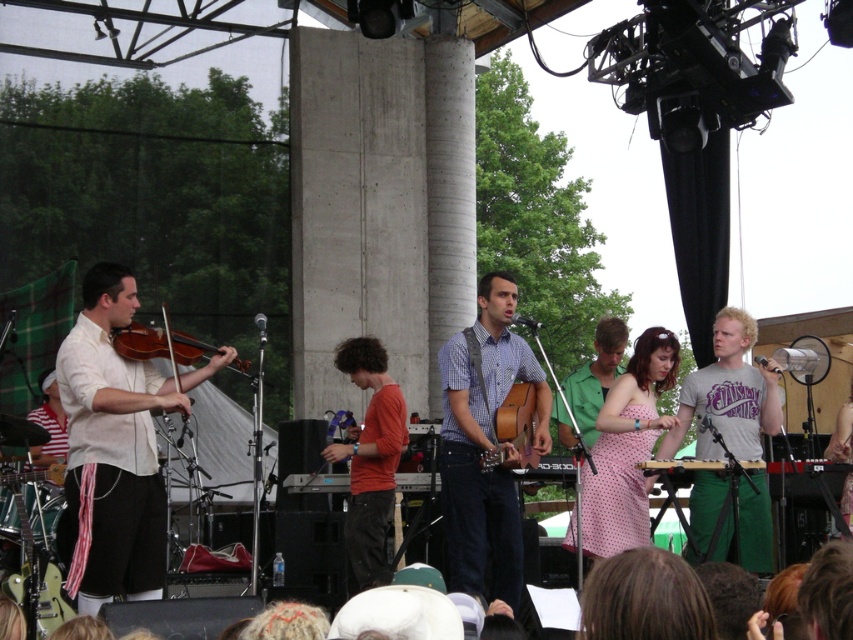
You are a photographer positioned at the center of the stage. You want to capture a closeup shot of the matte white shirt at left. Which direction should you move to get closer to it?

You should move to the left because the matte white shirt at left is located at point (115, 445), which is to the left of the center position.

You are a photographer trying to capture a group photo of the musicians. You notice the matte white shirt at left and the orange cotton shirt at center. Which musician should you position closer to the camera to ensure both appear equally sized in the photo?

Since the matte white shirt at left is wider than the orange cotton shirt at center, you should position the orange cotton shirt at center closer to the camera to balance their sizes in the photo.

You are a photographer positioned at the center of the stage. You want to capture a photo that includes both the matte white shirt at left and the red long sleeve shirt. Based on their positions, which direction should you move to ensure both are in the frame?

The matte white shirt at left is located at point (115, 445), so you should move to the left to include both the matte white shirt at left and the red long sleeve shirt in the frame.